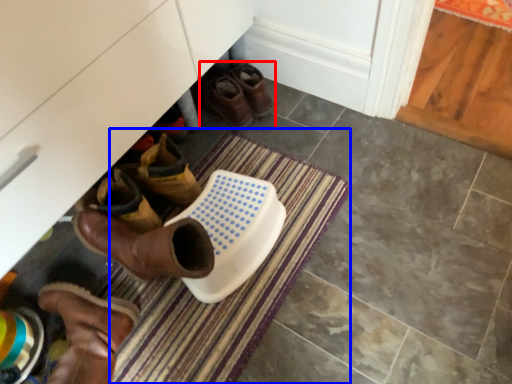
Question: Which object is closer to the camera taking this photo, footwear (highlighted by a red box) or bath mat (highlighted by a blue box)?

Choices:
 (A) footwear
 (B) bath mat

Answer: (B)